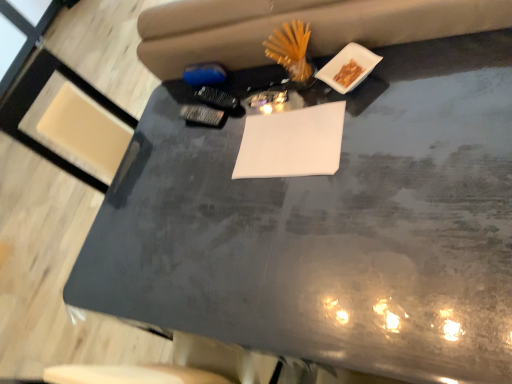
Where is `free location to the left of white paper at center`? The image size is (512, 384). free location to the left of white paper at center is located at coordinates (227, 206).